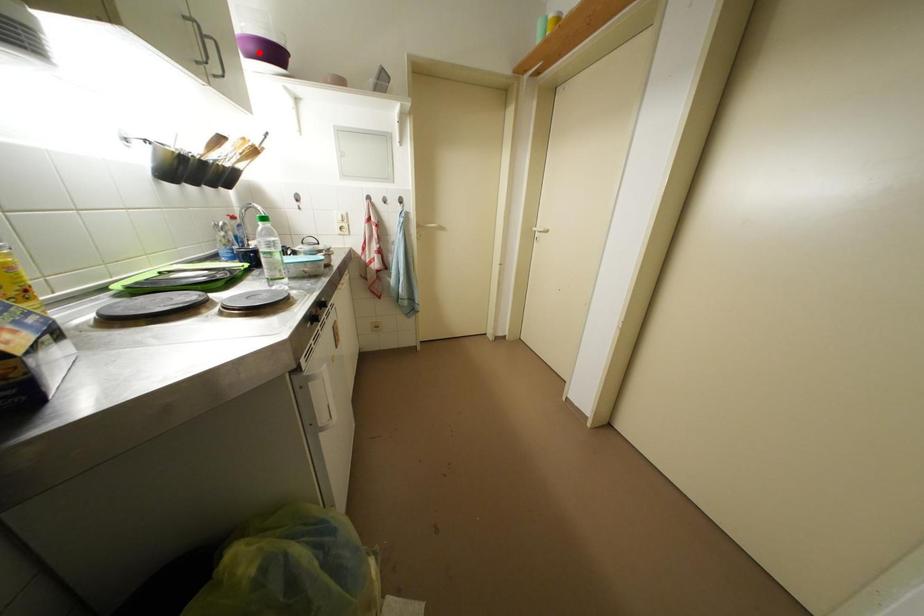
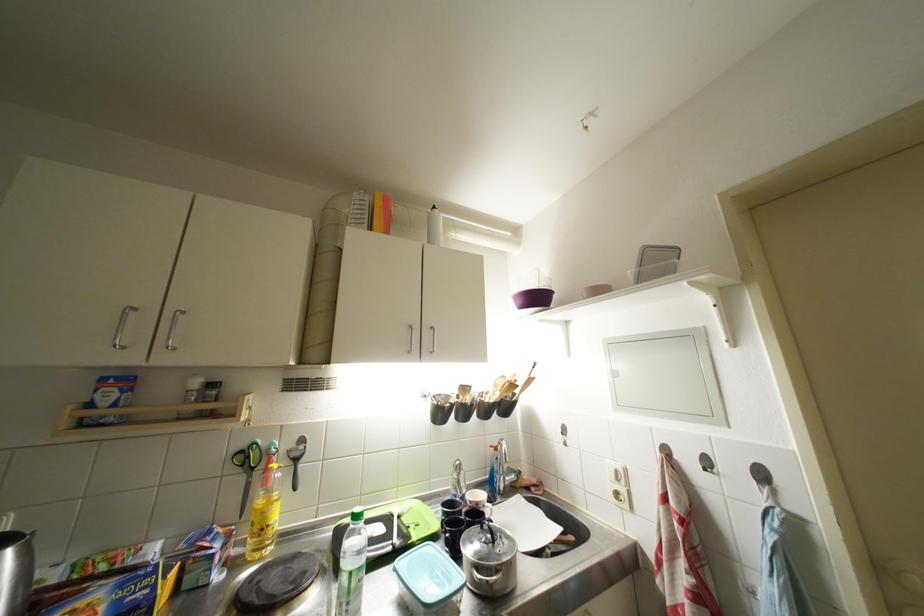
Question: I am providing you with two images of the same scene from different viewpoints. A red point is marked on the first image. Can you still see the location of the red point in image 2?

Choices:
 (A) Yes
 (B) No

Answer: (A)